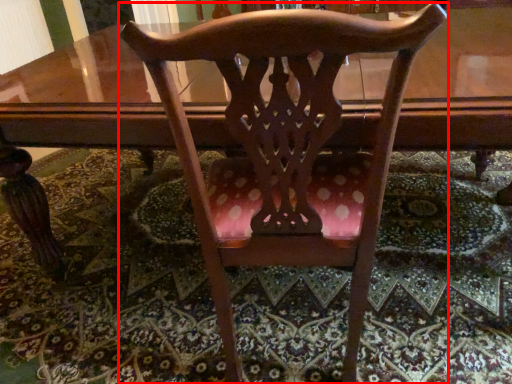
Question: In this image, where is chair (annotated by the red box) located relative to mat?

Choices:
 (A) left
 (B) right

Answer: (B)